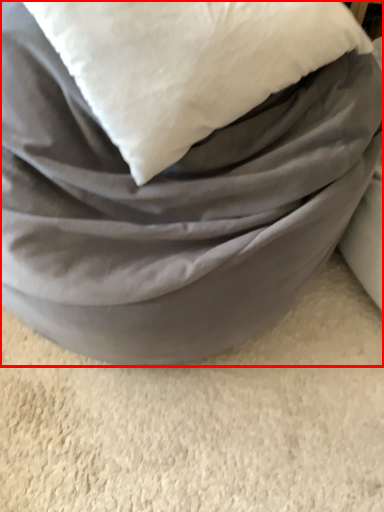
Question: From the image's perspective, considering the relative positions of furniture (annotated by the red box) and pillow in the image provided, where is furniture (annotated by the red box) located with respect to the staircase?

Choices:
 (A) below
 (B) above

Answer: (A)